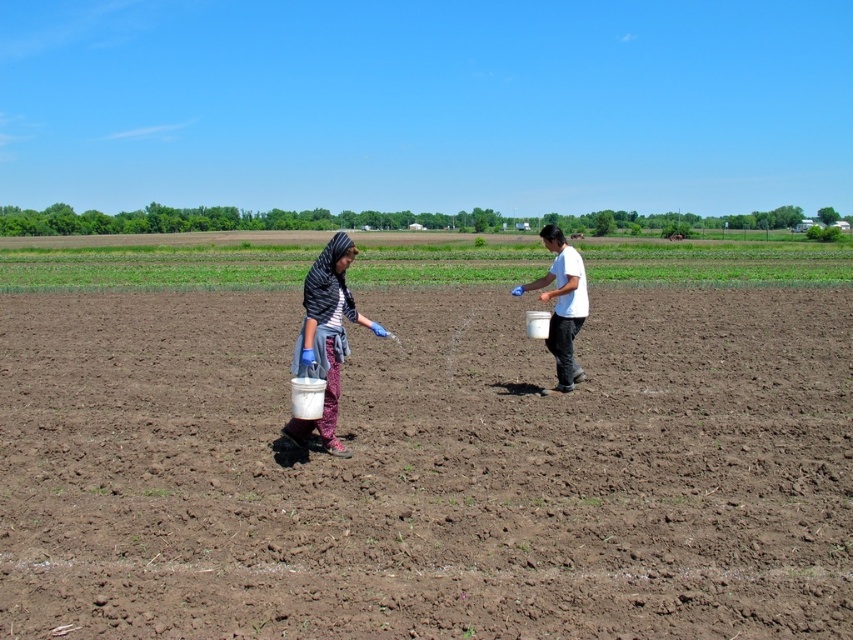
Which of these two, matte black bucket at center or white matte bucket at center, stands taller?

white matte bucket at center is taller.

Does matte black bucket at center have a greater height compared to white matte bucket at center?

No.

Between point (361, 317) and point (575, 326), which one is positioned in front?

Point (361, 317)

I want to click on matte black bucket at center, so click(326, 339).

Can you confirm if white plastic bucket at center is bigger than white matte bucket at center?

No.

Which of these two, white plastic bucket at center or white matte bucket at center, stands shorter?

Answer: With less height is white plastic bucket at center.

This screenshot has width=853, height=640. Describe the element at coordinates (326, 339) in the screenshot. I see `white plastic bucket at center` at that location.

This screenshot has height=640, width=853. Find the location of `white plastic bucket at center`. white plastic bucket at center is located at coordinates (326, 339).

Is brown soil at center bigger than white matte bucket at center?

Yes.

Is brown soil at center smaller than white matte bucket at center?

No.

Identify the location of brown soil at center. (428, 470).

Find the location of `brown soil at center`. brown soil at center is located at coordinates (428, 470).